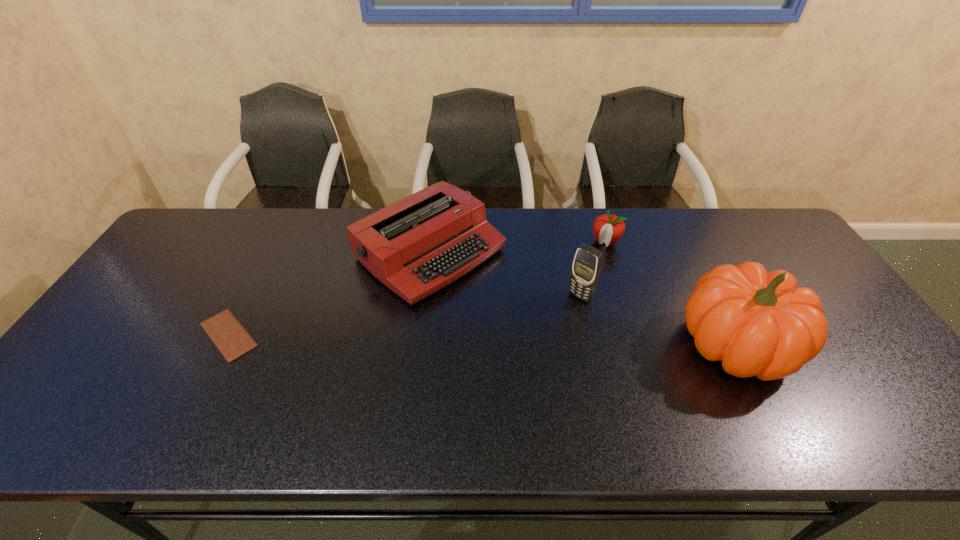
You are a GUI agent. You are given a task and a screenshot of the screen. Output one action in this format:
    pyautogui.click(x=<x>, y=<y>)
    Task: Click on the typewriter situated at the far edge
    The width and height of the screenshot is (960, 540).
    Given the screenshot: What is the action you would take?
    pyautogui.click(x=416, y=246)

At what (x,y) coordinates should I click in order to perform the action: click on object located at the near edge. Please return your answer as a coordinate pair (x, y). The height and width of the screenshot is (540, 960). Looking at the image, I should click on (758, 324).

Locate an element on the screen. This screenshot has width=960, height=540. vacant space at the far edge of the desktop is located at coordinates (633, 208).

Locate an element on the screen. The width and height of the screenshot is (960, 540). free location at the near edge of the desktop is located at coordinates (175, 380).

In order to click on vacant space at the right edge of the desktop in this screenshot , I will do `click(825, 367)`.

Find the location of a particular element. This screenshot has height=540, width=960. free space at the far left corner of the desktop is located at coordinates (204, 220).

The image size is (960, 540). Identify the location of free space at the near left corner of the desktop. (82, 388).

In the image, there is a desktop. Where is `free region at the far right corner`? The width and height of the screenshot is (960, 540). free region at the far right corner is located at coordinates (743, 220).

Identify the location of empty space between the fourth shortest object and the second object from left to right. (505, 275).

Find the location of a particular element. The image size is (960, 540). unoccupied position between the cellular telephone and the leftmost object is located at coordinates (404, 315).